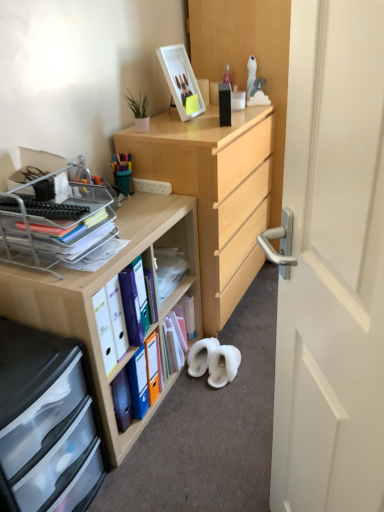
The image size is (384, 512). I want to click on vacant area located to the right-hand side of multicolored plastic pen holder at upper left, so click(155, 199).